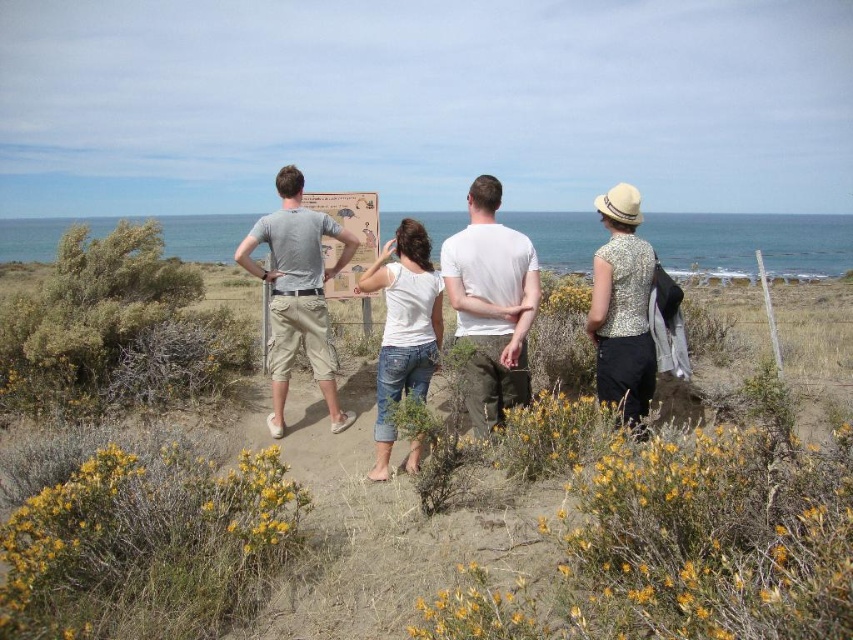
You are standing at the position of the viewer in the image. There is a yellow fuzzy bush at lower center. If you want to pick a flower from it, how many steps do you need to take to reach it?

The yellow fuzzy bush at lower center is 2.06 meters away from the viewer. Assuming an average step length of about 0.75 meters, you would need to take approximately 3 steps to reach it.